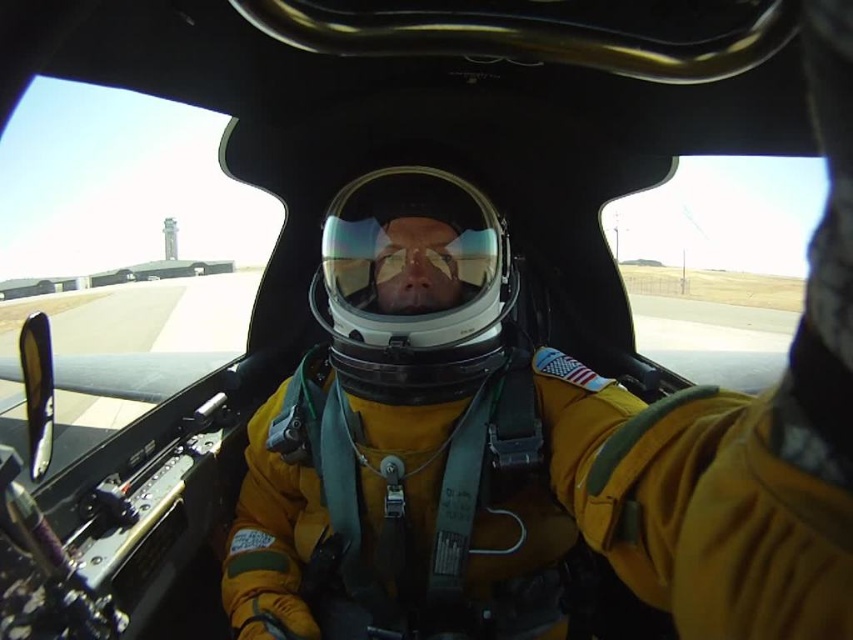
Is yellow fabric helmet at center bigger than transparent reflective helmet at center?

Correct, yellow fabric helmet at center is larger in size than transparent reflective helmet at center.

Which is in front, point (323, 284) or point (482, 268)?

Positioned in front is point (482, 268).

Locate an element on the screen. The width and height of the screenshot is (853, 640). yellow fabric helmet at center is located at coordinates (404, 436).

Does point (370, 294) come behind point (454, 266)?

Yes, it is behind point (454, 266).

Who is more distant from viewer, (374, 305) or (451, 292)?

Positioned behind is point (374, 305).

The height and width of the screenshot is (640, 853). What do you see at coordinates (413, 285) in the screenshot? I see `transparent plastic helmet at center` at bounding box center [413, 285].

Where is `transparent plastic helmet at center`? transparent plastic helmet at center is located at coordinates (413, 285).

Is yellow fabric helmet at center shorter than transparent plastic helmet at center?

In fact, yellow fabric helmet at center may be taller than transparent plastic helmet at center.

Can you confirm if yellow fabric helmet at center is positioned to the left of transparent plastic helmet at center?

Indeed, yellow fabric helmet at center is positioned on the left side of transparent plastic helmet at center.

This screenshot has width=853, height=640. Identify the location of yellow fabric helmet at center. (404, 436).

At what (x,y) coordinates should I click in order to perform the action: click on yellow fabric helmet at center. Please return your answer as a coordinate pair (x, y). The height and width of the screenshot is (640, 853). Looking at the image, I should click on (404, 436).